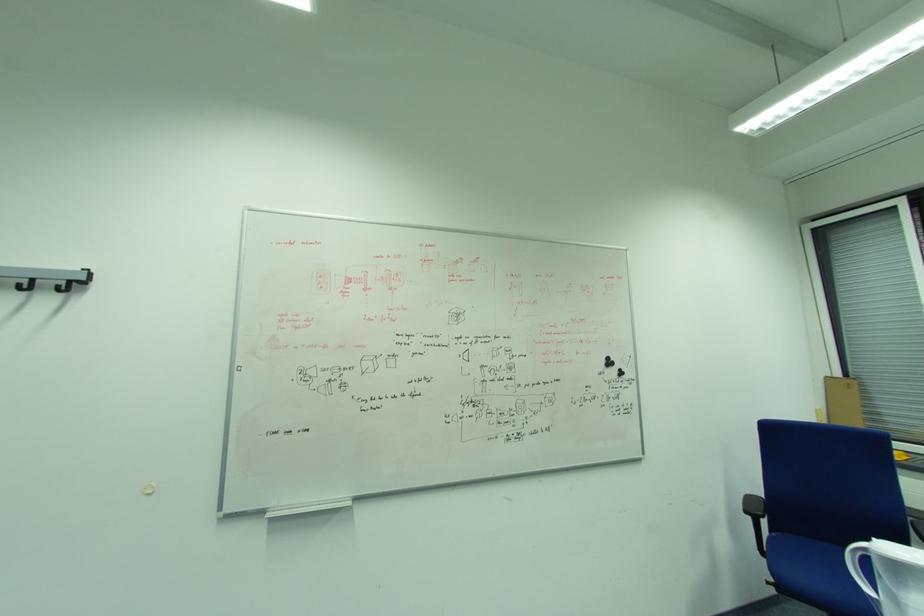
The width and height of the screenshot is (924, 616). I want to click on black chair armrest, so click(x=754, y=506).